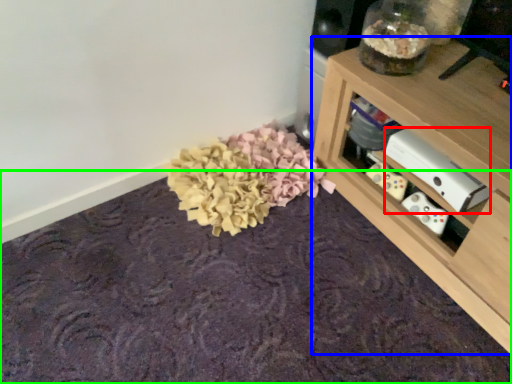
Question: Based on their relative distances, which object is farther from appliance (highlighted by a red box)? Choose from shelf (highlighted by a blue box) and mat (highlighted by a green box).

Choices:
 (A) shelf
 (B) mat

Answer: (B)